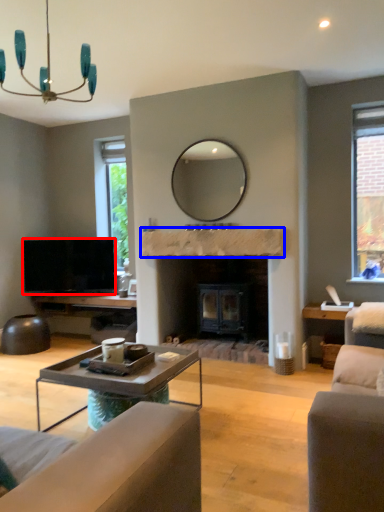
Question: Which object is closer to the camera taking this photo, television (highlighted by a red box) or mantle (highlighted by a blue box)?

Choices:
 (A) television
 (B) mantle

Answer: (B)